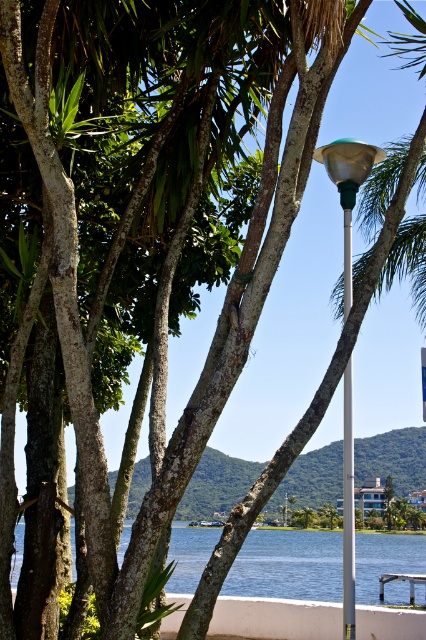
You are standing in the serene outdoor scene with the blue water at lower center and the green plastic pole at center. Which object is closer to you?

The blue water at lower center is closer to you than the green plastic pole at center.

You are standing at the point where the image is centered. Looking towards the point marked at coordinates point [348,188], which object from the scene would you see in that direction?

The green plastic lamp post at upper center is located at point [348,188], so you would see the green plastic lamp post at upper center in that direction.

You are standing at the center of the image and want to sit down. Which object from the following list is the closest to you? The options are the wooden park bench at lower right and the boats docked along the shore.

The wooden park bench at lower right is closer to you because it is located at point [402,580], which is closer to the center than the boats docked along the shore.